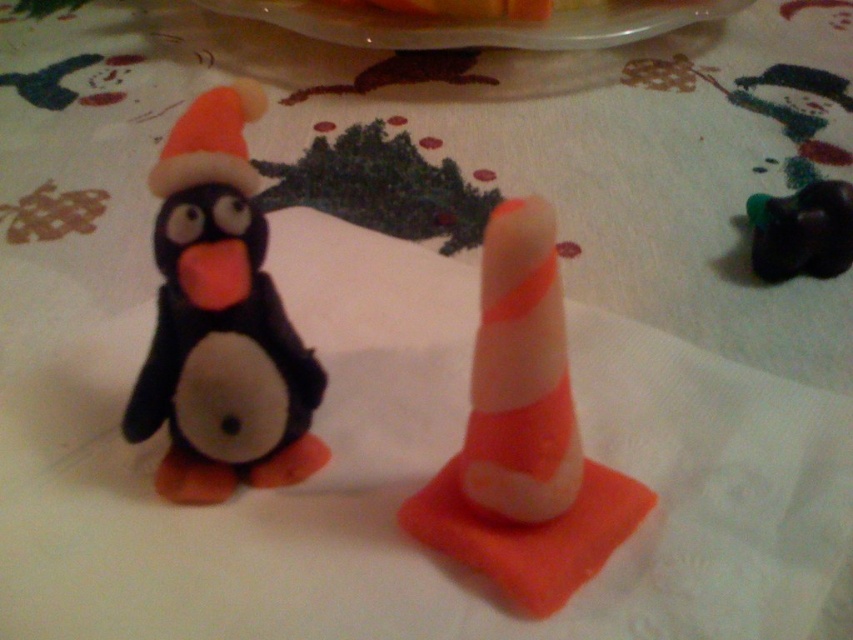
Which is behind, point (218, 381) or point (445, 465)?

Point (445, 465)

Does matte black penguin at left have a lesser width compared to orange striped foam cone at center?

Yes.

Identify the location of matte black penguin at left. The image size is (853, 640). (219, 321).

Can you confirm if matte black penguin at left is taller than translucent plastic platter at upper center?

Yes.

At what (x,y) coordinates should I click in order to perform the action: click on matte black penguin at left. Please return your answer as a coordinate pair (x, y). The width and height of the screenshot is (853, 640). Looking at the image, I should click on (219, 321).

This screenshot has height=640, width=853. In order to click on matte black penguin at left in this screenshot , I will do `click(219, 321)`.

Who is more distant from viewer, (498, 516) or (334, 29)?

The point (334, 29) is more distant.

Does orange striped foam cone at center have a smaller size compared to translucent plastic platter at upper center?

Yes.

Who is more distant from viewer, (x=489, y=570) or (x=434, y=38)?

The point (x=434, y=38) is more distant.

You are a GUI agent. You are given a task and a screenshot of the screen. Output one action in this format:
    pyautogui.click(x=<x>, y=<y>)
    Task: Click on the orange striped foam cone at center
    The width and height of the screenshot is (853, 640).
    Given the screenshot: What is the action you would take?
    pyautogui.click(x=524, y=438)